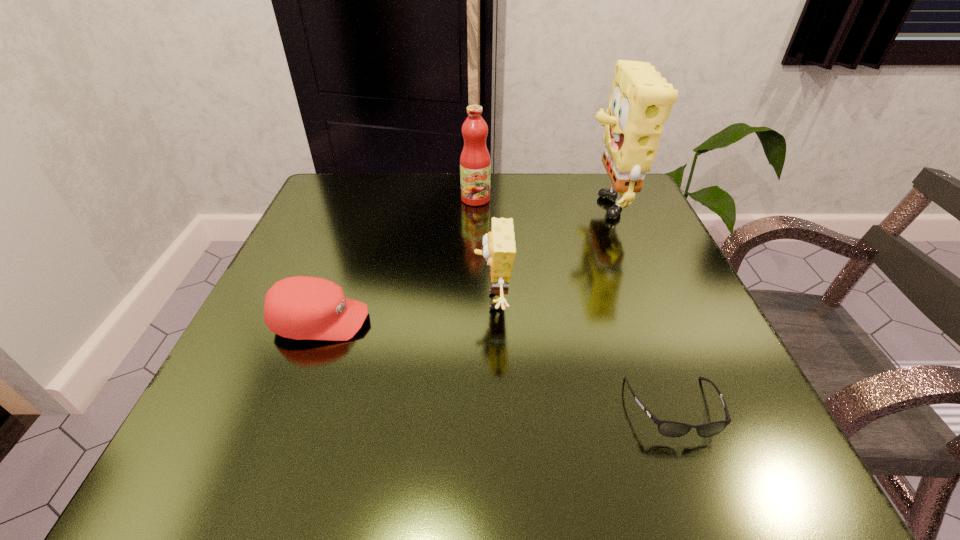
Image resolution: width=960 pixels, height=540 pixels. In order to click on the tallest object in this screenshot , I will do `click(641, 101)`.

Where is `the taller sponge`? the taller sponge is located at coordinates (641, 101).

This screenshot has height=540, width=960. Find the location of `fruit juice`. fruit juice is located at coordinates (475, 165).

I want to click on the nearer sponge, so (x=499, y=250).

I want to click on the shorter sponge, so click(499, 250).

Where is `the leftmost object`? The height and width of the screenshot is (540, 960). the leftmost object is located at coordinates (301, 307).

The image size is (960, 540). Find the location of `the second shortest object`. the second shortest object is located at coordinates (301, 307).

At what (x,y) coordinates should I click in order to perform the action: click on sunglasses. Please return your answer as a coordinate pair (x, y). The width and height of the screenshot is (960, 540). Looking at the image, I should click on (666, 428).

In order to click on the nearest object in this screenshot , I will do `click(666, 428)`.

At what (x,y) coordinates should I click in order to perform the action: click on free space located on the face of the right sponge. Please return your answer as a coordinate pair (x, y). Looking at the image, I should click on (523, 201).